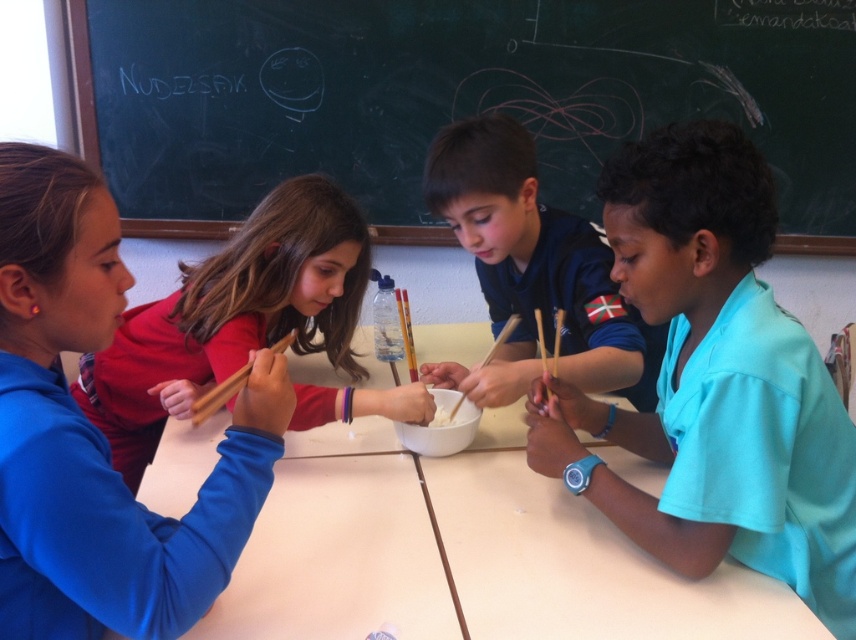
You are a teacher observing the children at the table. You notice the teal smooth shirt at right and the wooden chopsticks at center. Which object is taller?

The teal smooth shirt at right is taller than the wooden chopsticks at center.

You are a teacher observing the children at the table. You need to determine which object is bigger between the blue fabric shirt at center and the wooden chopsticks at upper center. Which one is larger?

The blue fabric shirt at center is larger in size than the wooden chopsticks at upper center.